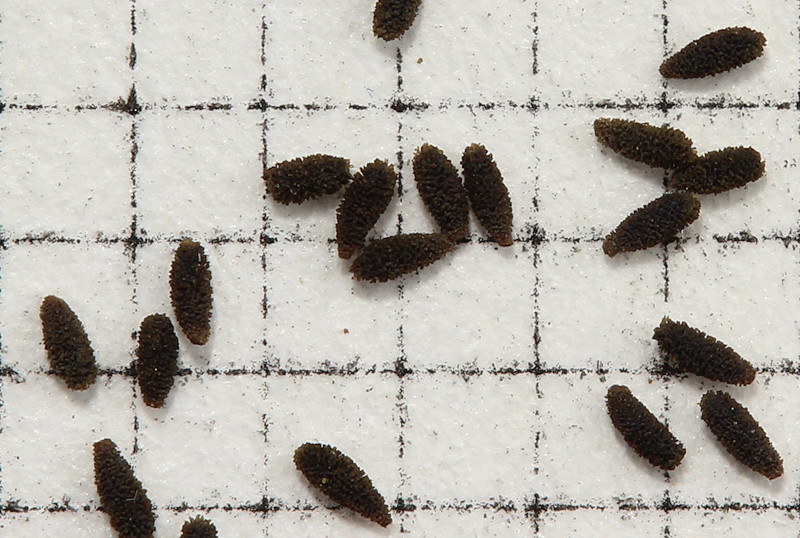
Find the location of a particular element. corners is located at coordinates (396, 110), (528, 107), (538, 240), (264, 240), (264, 104), (400, 233).